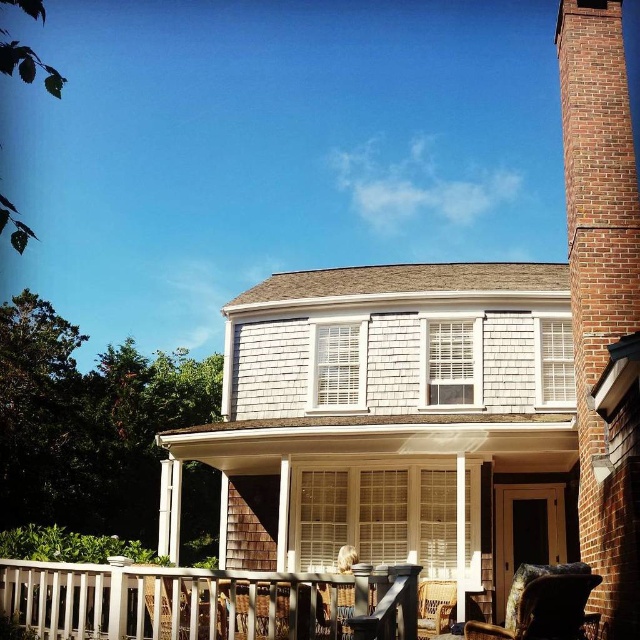
Does white wood porch at lower center have a larger size compared to wooden wicker chair at lower right?

No, white wood porch at lower center is not bigger than wooden wicker chair at lower right.

Consider the image. Is white wood porch at lower center positioned at the back of wooden wicker chair at lower right?

No, it is not.

Who is more forward, (113, 582) or (422, 616)?

Point (113, 582) is in front.

The width and height of the screenshot is (640, 640). What are the coordinates of `white wood porch at lower center` in the screenshot? It's located at (205, 602).

Is leather textured chair at lower right in front of wooden wicker chair at lower right?

Yes, leather textured chair at lower right is closer to the viewer.

Can you confirm if leather textured chair at lower right is positioned to the left of wooden wicker chair at lower right?

Incorrect, leather textured chair at lower right is not on the left side of wooden wicker chair at lower right.

Is point (548, 627) less distant than point (426, 609)?

Yes.

Where is `leather textured chair at lower right`? The width and height of the screenshot is (640, 640). leather textured chair at lower right is located at coordinates (541, 604).

Who is higher up, white shingles at center or white wood porch at lower center?

Positioned higher is white shingles at center.

Is white shingles at center positioned in front of white wood porch at lower center?

No, white shingles at center is behind white wood porch at lower center.

Who is more distant from viewer, (276, 502) or (257, 611)?

Positioned behind is point (276, 502).

In order to click on white shingles at center in this screenshot , I will do pyautogui.click(x=394, y=422).